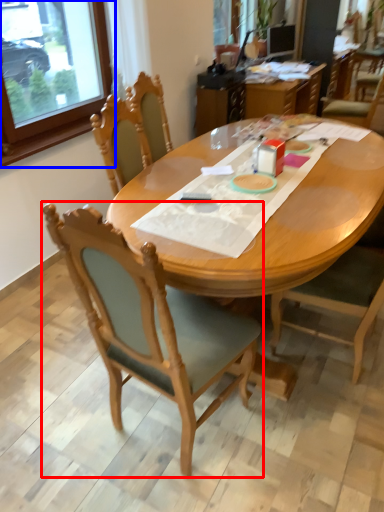
Question: Which object is further to the camera taking this photo, chair (highlighted by a red box) or window frame (highlighted by a blue box)?

Choices:
 (A) chair
 (B) window frame

Answer: (B)